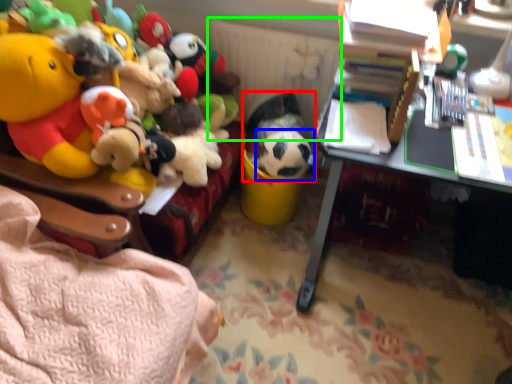
Question: Estimate the real-world distances between objects in this image. Which object is farther from toy (highlighted by a red box), toy (highlighted by a blue box) or radiator (highlighted by a green box)?

Choices:
 (A) toy
 (B) radiator

Answer: (B)